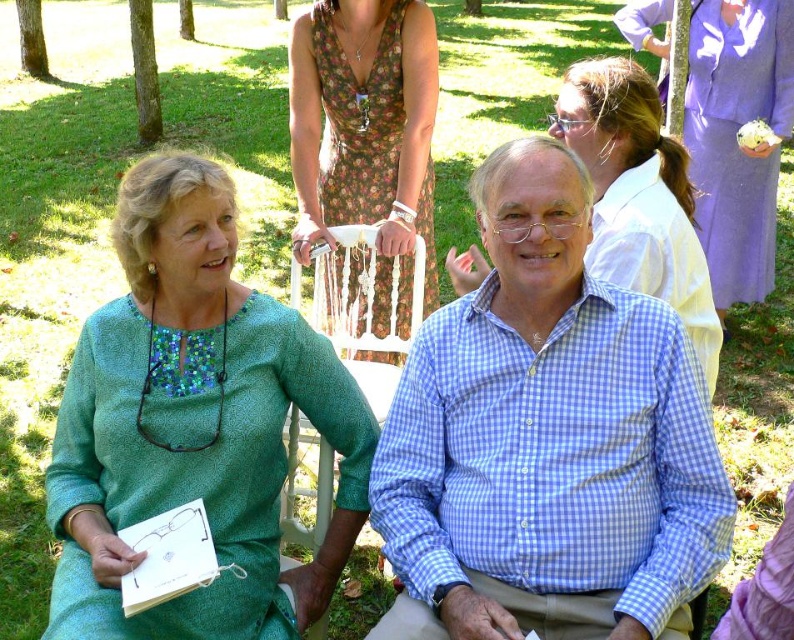
You are a photographer standing at the center of the scene. You want to take a photo that includes both the blue checkered shirt at center and the lavender satin dress at upper right. Given that your camera has a maximum focal length that allows capturing objects within a 3 meter range, will you be able to include both subjects in the same frame?

The distance between the blue checkered shirt at center and the lavender satin dress at upper right is 2.92 meters, which is within the 3 meter range. Therefore, you can include both subjects in the same frame.

You are a photographer trying to capture the man in the blue checkered shirt at center. The camera you are using has a focus point at coordinates 0.680, 0.690. Will the focus point align with the man?

The position of blue checkered shirt at center is at point (546,435), so yes, the focus point will align with the man in the blue checkered shirt at center.

You are standing at the edge of the park and notice two people sitting on chairs at the center. You want to approach them to ask for directions. The blue checkered shirt at center and the floral dress at center are both visible. How far apart are these two individuals?

The blue checkered shirt at center is 4.66 feet away from the floral dress at center, so the two individuals are approximately 4.66 feet apart.